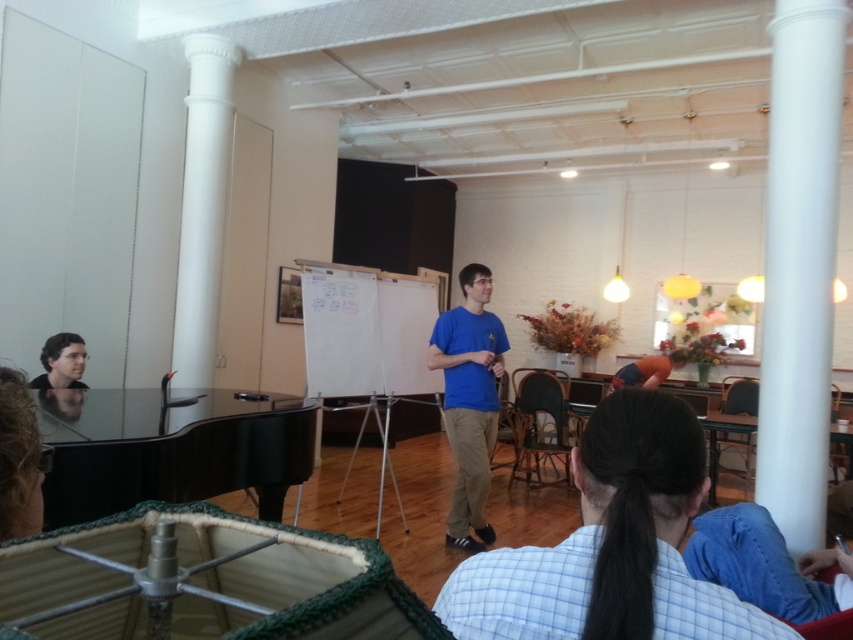
In the scene shown: You are a photographer setting up for an event in this room. You need to position a spotlight so that it illuminates both the blue cotton shirt at center and the matte black hair at lower left equally. Based on their positions, where should you aim the spotlight?

Since the blue cotton shirt at center is to the right of the matte black hair at lower left, you should aim the spotlight between them to ensure both receive equal illumination.

Looking at this image, you are organizing a photo shoot in this room and need to ensure that the blue cotton shirt at center and the matte black hair at lower left are both visible in the frame. Based on their positions, which object should be placed closer to the camera to ensure both are fully visible?

The matte black hair at lower left should be placed closer to the camera because the blue cotton shirt at center might be wider than matte black hair at lower left, so positioning the narrower object closer ensures both fit within the frame.